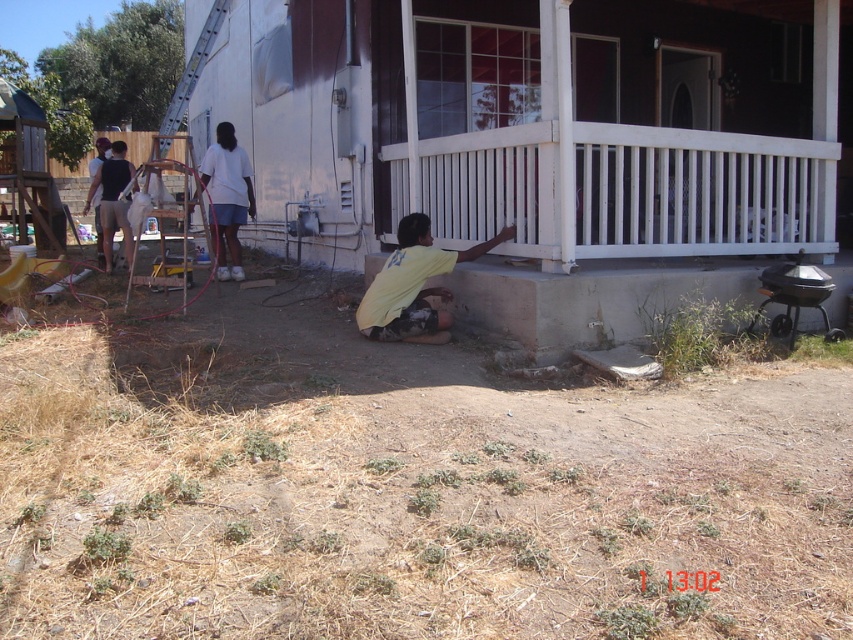
Based on the photo, is white painted wood porch at lower right in front of white cotton shirt at upper left?

Yes, white painted wood porch at lower right is in front of white cotton shirt at upper left.

Does white painted wood porch at lower right appear under white cotton shirt at upper left?

Indeed, white painted wood porch at lower right is positioned under white cotton shirt at upper left.

Is point (811, 195) positioned after point (207, 161)?

No.

Where is `white painted wood porch at lower right`? Image resolution: width=853 pixels, height=640 pixels. white painted wood porch at lower right is located at coordinates (619, 189).

Can you confirm if white painted wood porch at lower right is positioned above yellow matte shirt at center?

Yes, white painted wood porch at lower right is above yellow matte shirt at center.

How much distance is there between white painted wood porch at lower right and yellow matte shirt at center?

A distance of 1.05 meters exists between white painted wood porch at lower right and yellow matte shirt at center.

Image resolution: width=853 pixels, height=640 pixels. What do you see at coordinates (619, 189) in the screenshot?
I see `white painted wood porch at lower right` at bounding box center [619, 189].

This screenshot has width=853, height=640. In order to click on white painted wood porch at lower right in this screenshot , I will do `click(619, 189)`.

Does yellow matte shirt at center appear over white cotton shirt at upper left?

No, yellow matte shirt at center is not above white cotton shirt at upper left.

Can you confirm if yellow matte shirt at center is positioned below white cotton shirt at upper left?

Indeed, yellow matte shirt at center is positioned under white cotton shirt at upper left.

Does point (399, 285) lie behind point (218, 220)?

No, (399, 285) is in front of (218, 220).

Find the location of a particular element. This screenshot has width=853, height=640. yellow matte shirt at center is located at coordinates point(415,285).